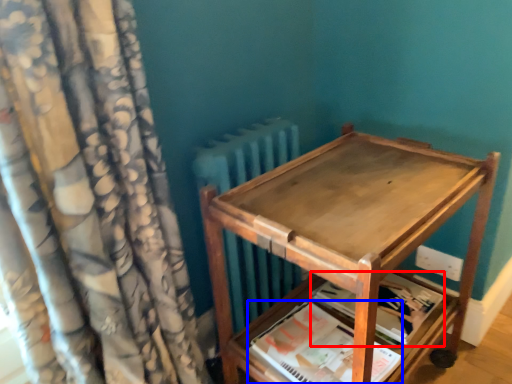
Question: Among these objects, which one is farthest to the camera, paperback book (highlighted by a red box) or paperback book (highlighted by a blue box)?

Choices:
 (A) paperback book
 (B) paperback book

Answer: (A)